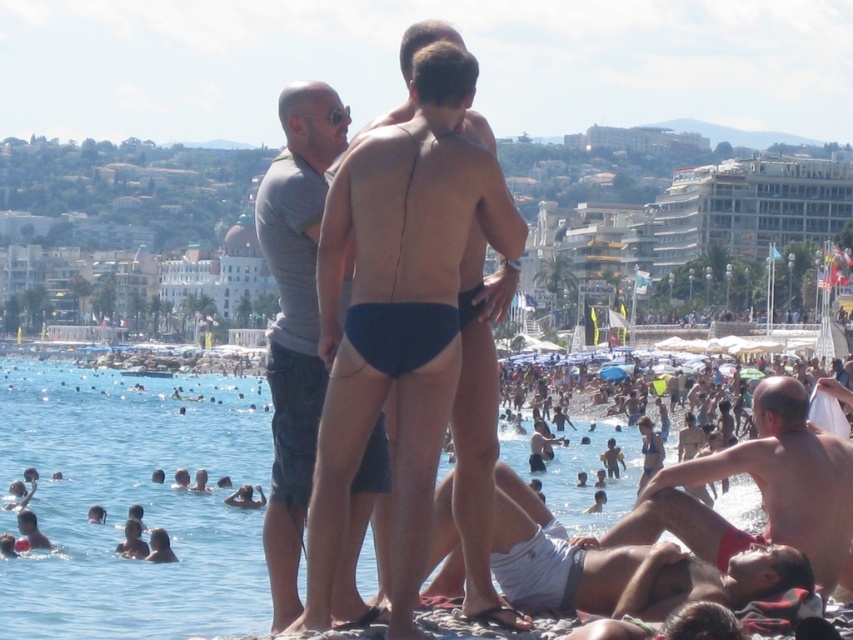
You are standing on the beach and want to walk from point A to point B. Point A is at coordinates point (90, 433) and point B is at coordinates point (444, 500). Which direction should you move to get from point A to point B?

To move from point A to point B, you should move away from the viewer since point A is closer to the viewer than point B.